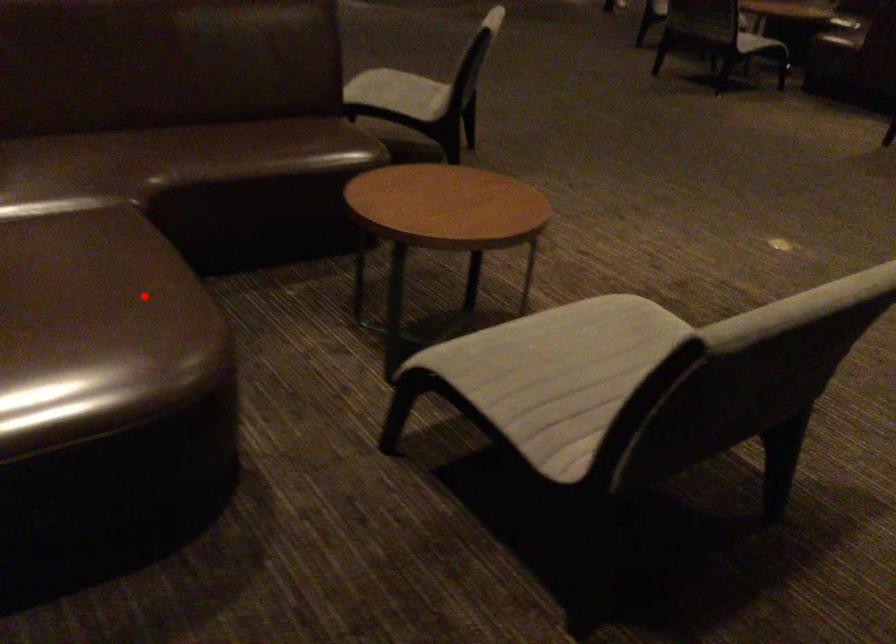
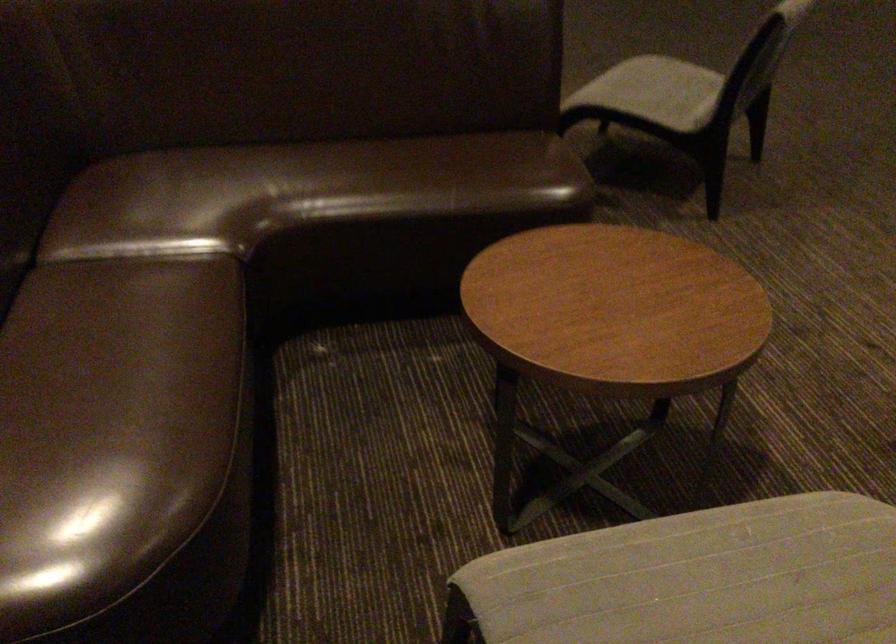
Locate, in the second image, the point that corresponds to the highlighted location in the first image.

(112, 426)